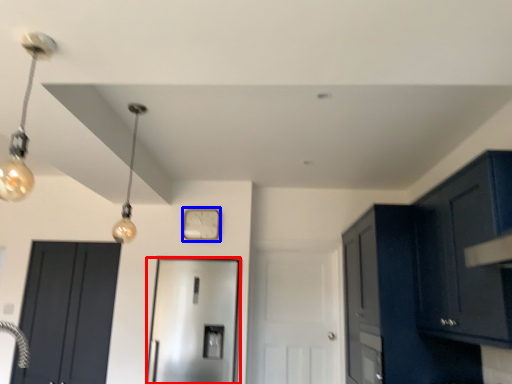
Question: Among these objects, which one is nearest to the camera, door (highlighted by a red box) or clock (highlighted by a blue box)?

Choices:
 (A) door
 (B) clock

Answer: (A)